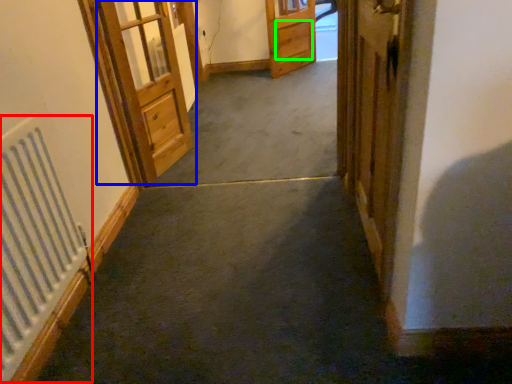
Question: Estimate the real-world distances between objects in this image. Which object is closer to radiator (highlighted by a red box), door (highlighted by a blue box) or drawer (highlighted by a green box)?

Choices:
 (A) door
 (B) drawer

Answer: (A)